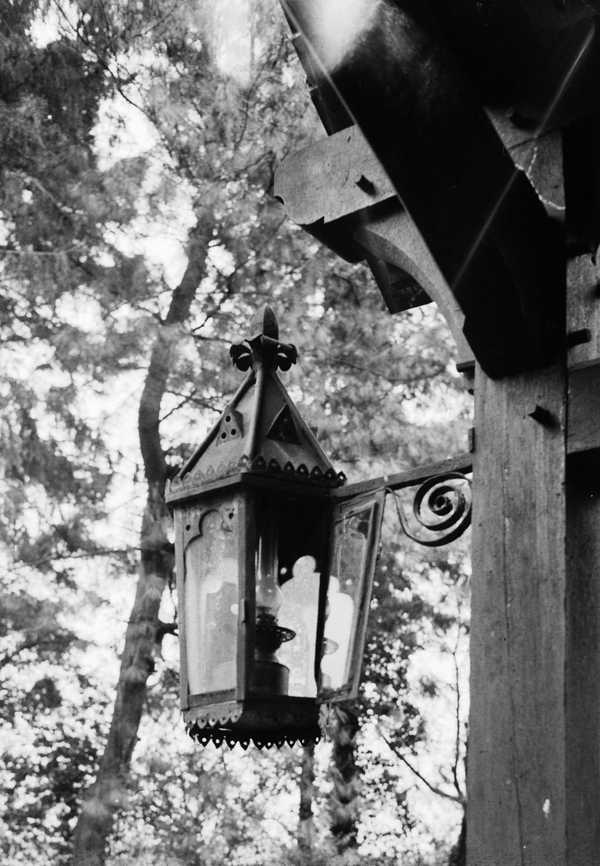
You are a GUI agent. You are given a task and a screenshot of the screen. Output one action in this format:
    pyautogui.click(x=<x>, y=<y>)
    Task: Click on the wood hanging out from beam
    This screenshot has height=866, width=600.
    Given the screenshot: What is the action you would take?
    pyautogui.click(x=406, y=477)